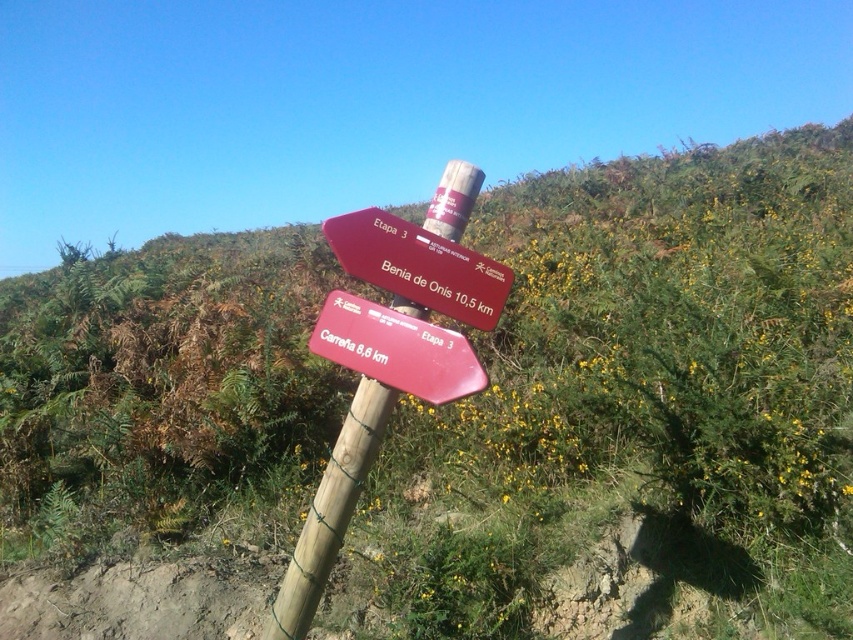
How far apart are wooden post at center and red matte signpost at center?

wooden post at center is 31.00 centimeters from red matte signpost at center.

Is point (430, 220) positioned in front of point (439, 385)?

That is False.

You are a GUI agent. You are given a task and a screenshot of the screen. Output one action in this format:
    pyautogui.click(x=<x>, y=<y>)
    Task: Click on the wooden post at center
    The height and width of the screenshot is (640, 853).
    Given the screenshot: What is the action you would take?
    pyautogui.click(x=329, y=512)

What are the coordinates of `wooden post at center` in the screenshot? It's located at (329, 512).

Who is higher up, red plastic sign at center or red matte signpost at center?

red plastic sign at center is above.

Which is below, red plastic sign at center or red matte signpost at center?

red matte signpost at center

Image resolution: width=853 pixels, height=640 pixels. What do you see at coordinates (419, 266) in the screenshot?
I see `red plastic sign at center` at bounding box center [419, 266].

Find the location of a particular element. red plastic sign at center is located at coordinates (419, 266).

Locate an element on the screen. Image resolution: width=853 pixels, height=640 pixels. wooden post at center is located at coordinates (329, 512).

Does point (360, 481) come in front of point (482, 314)?

No, (360, 481) is behind (482, 314).

At what (x,y) coordinates should I click in order to perform the action: click on wooden post at center. Please return your answer as a coordinate pair (x, y). Looking at the image, I should click on (329, 512).